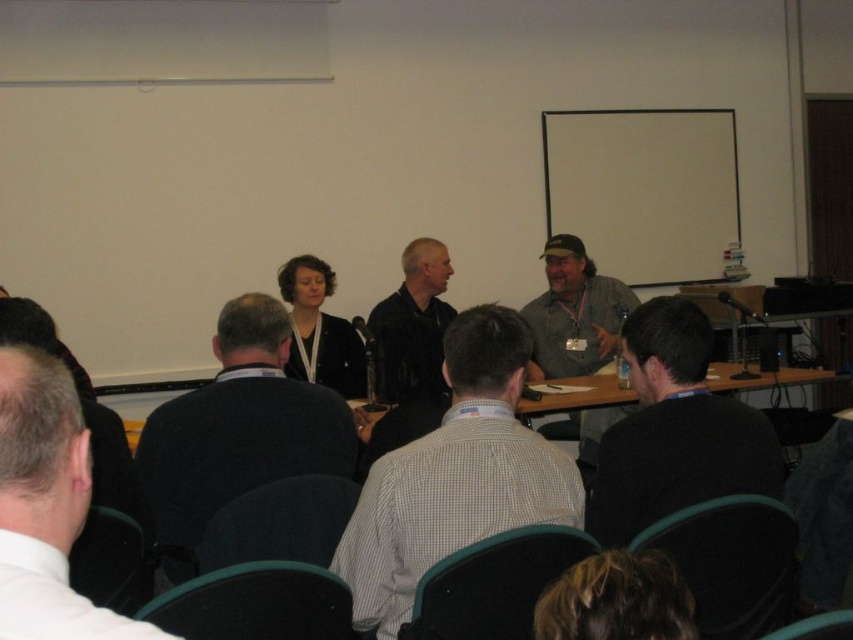
Question: Is dark blue sweater at center bigger than wooden table at center?

Choices:
 (A) no
 (B) yes

Answer: (B)

Question: Is white checkered shirt at center positioned in front of black matte shirt at center?

Choices:
 (A) no
 (B) yes

Answer: (B)

Question: Which point appears farthest from the camera in this image?

Choices:
 (A) (71, 394)
 (B) (495, 305)

Answer: (B)

Question: Is the position of white checkered shirt at center more distant than that of black matte shirt at lower right?

Choices:
 (A) yes
 (B) no

Answer: (B)

Question: Which point is closer to the camera?

Choices:
 (A) dark blue sweater at center
 (B) white shirt at left
 (C) gray fabric shirt at center

Answer: (B)

Question: Estimate the real-world distances between objects in this image. Which object is closer to the black matte shirt at lower right?

Choices:
 (A) black matte shirt at center
 (B) white shirt at left

Answer: (B)